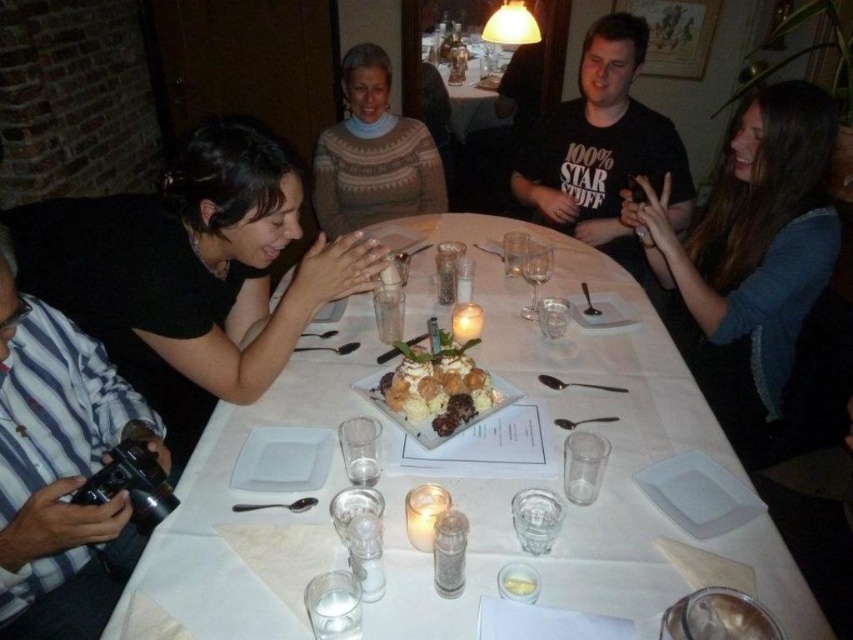
You are a photographer trying to capture a clear shot of the dessert platter. You notice two people at the table, the black matte shirt at left and the brown knitted sweater at center. Which person is closer to the dessert platter?

The black matte shirt at left is closer to the dessert platter because they are in front of the brown knitted sweater at center.

You are sitting at the dining table in the cozy restaurant scene. There are two points marked on the tablecloth, one at coordinates point (325,168) and another at point (438,81). If you want to place a napkin between these two points so that it is closer to the point that is farther from you, where should you place it?

You should place the napkin closer to point (438,81) because point (325,168) is in front of point (438,81), meaning point (438,81) is farther away from you. Placing the napkin closer to the farther point ensures it is between them while prioritizing proximity to the distant point.